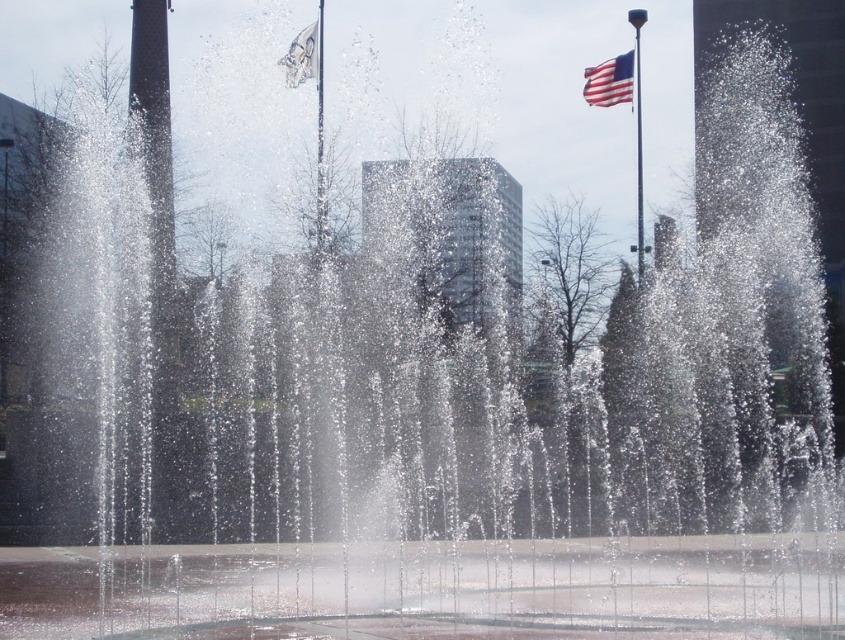
From the picture: Does american flag at upper right appear over white fabric flag at upper center?

No, american flag at upper right is not above white fabric flag at upper center.

Who is higher up, american flag at upper right or white fabric flag at upper center?

white fabric flag at upper center is above.

You are a GUI agent. You are given a task and a screenshot of the screen. Output one action in this format:
    pyautogui.click(x=<x>, y=<y>)
    Task: Click on the american flag at upper right
    The image size is (845, 640).
    Given the screenshot: What is the action you would take?
    pyautogui.click(x=609, y=81)

Identify the location of american flag at upper right. (609, 81).

Between metallic flag pole at center and white fabric flag at upper center, which one is positioned lower?

Positioned lower is white fabric flag at upper center.

How distant is metallic flag pole at center from white fabric flag at upper center?

→ 10.01 feet

Identify the location of metallic flag pole at center. (320, 140).

Does american flag at upper right appear over polished metal flag pole at upper right?

Correct, american flag at upper right is located above polished metal flag pole at upper right.

Can you confirm if american flag at upper right is thinner than polished metal flag pole at upper right?

Incorrect, american flag at upper right's width is not less than polished metal flag pole at upper right's.

Which is in front, point (627, 77) or point (636, 80)?

Point (627, 77) is more forward.

Image resolution: width=845 pixels, height=640 pixels. What are the coordinates of `american flag at upper right` in the screenshot? It's located at (609, 81).